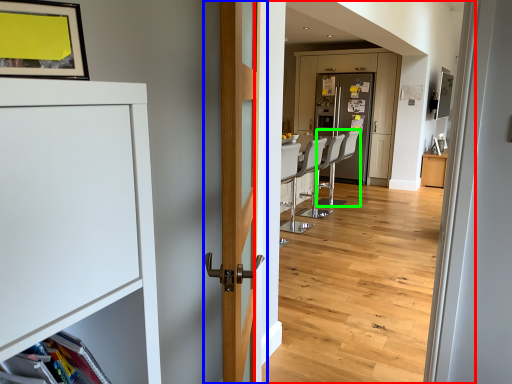
Question: Which object is the closest to the corridor (highlighted by a red box)? Choose among these: door (highlighted by a blue box) or armchair (highlighted by a green box).

Choices:
 (A) door
 (B) armchair

Answer: (B)